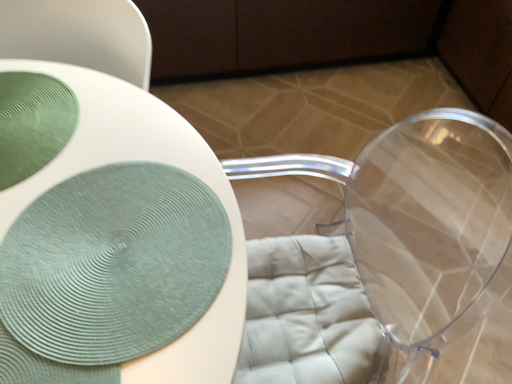
Question: From the image's perspective, is green textured placemat at center located above green textured plate at upper left?

Choices:
 (A) no
 (B) yes

Answer: (A)

Question: Does green textured placemat at center lie in front of green textured plate at upper left?

Choices:
 (A) yes
 (B) no

Answer: (A)

Question: Is green textured placemat at center taller than green textured plate at upper left?

Choices:
 (A) yes
 (B) no

Answer: (A)

Question: From the image's perspective, would you say green textured placemat at center is shown under green textured plate at upper left?

Choices:
 (A) yes
 (B) no

Answer: (A)

Question: Does green textured placemat at center have a lesser height compared to green textured plate at upper left?

Choices:
 (A) yes
 (B) no

Answer: (B)

Question: Is green textured placemat at center to the left of green textured plate at upper left from the viewer's perspective?

Choices:
 (A) yes
 (B) no

Answer: (B)

Question: From the image's perspective, is green textured plate at upper left located above green textured placemat at center?

Choices:
 (A) no
 (B) yes

Answer: (B)

Question: Is green textured plate at upper left at the left side of green textured placemat at center?

Choices:
 (A) no
 (B) yes

Answer: (B)

Question: Does green textured plate at upper left have a lesser width compared to green textured placemat at center?

Choices:
 (A) yes
 (B) no

Answer: (A)

Question: Would you say green textured plate at upper left is a long distance from green textured placemat at center?

Choices:
 (A) yes
 (B) no

Answer: (B)

Question: Is green textured plate at upper left taller than green textured placemat at center?

Choices:
 (A) no
 (B) yes

Answer: (A)

Question: From a real-world perspective, is green textured plate at upper left located higher than green textured placemat at center?

Choices:
 (A) yes
 (B) no

Answer: (A)

Question: Looking at their shapes, would you say green textured placemat at center is wider or thinner than green textured plate at upper left?

Choices:
 (A) wide
 (B) thin

Answer: (A)